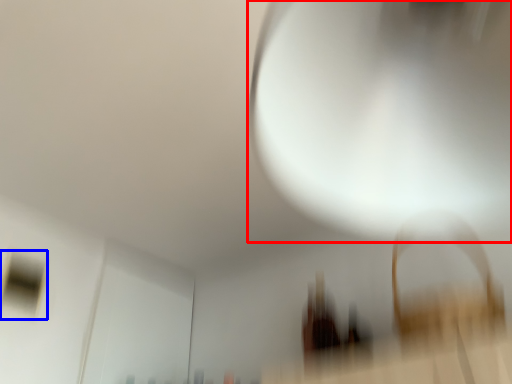
Question: Which object is further to the camera taking this photo, light (highlighted by a red box) or window (highlighted by a blue box)?

Choices:
 (A) light
 (B) window

Answer: (B)